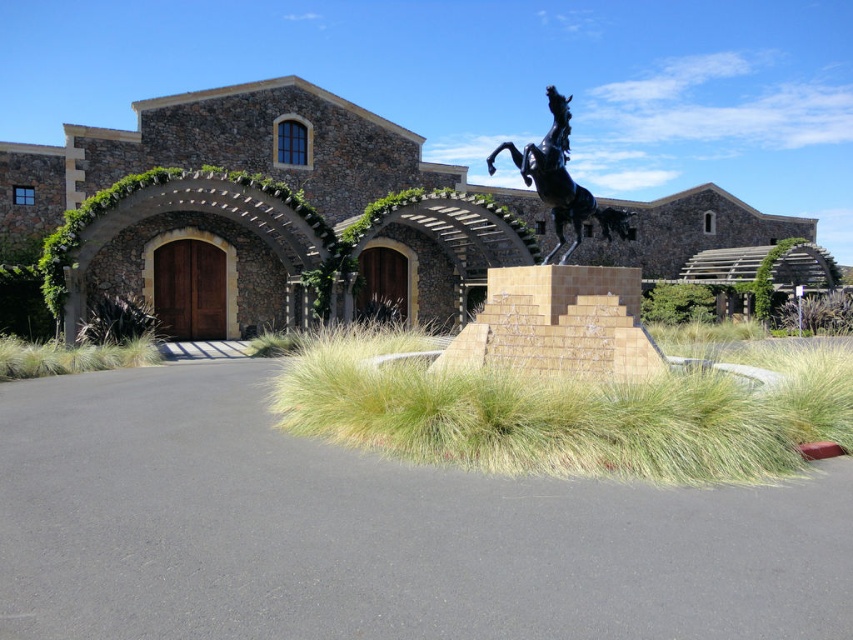
You are standing at the entrance of the grand architectural structure and want to place a small decorative pot exactly at the center of the black asphalt area marked by point (373, 532). Can you confirm if this point is indeed the center of the black asphalt area?

Yes, the point (373, 532) marks the center of the black asphalt area, so placing the decorative pot there would be accurate.

You are standing at the entrance of the winery and want to place a small potted plant on the black asphalt at center. What are the coordinates where you should place it?

The coordinates for placing the small potted plant on the black asphalt at center are point (373, 532).

Consider the image. You are a gardener planning to plant flowers between the black asphalt at center and the green grass at lower left. Which surface is lower in elevation?

The black asphalt at center has a lesser height compared to the green grass at lower left, so the black asphalt at center is lower in elevation.